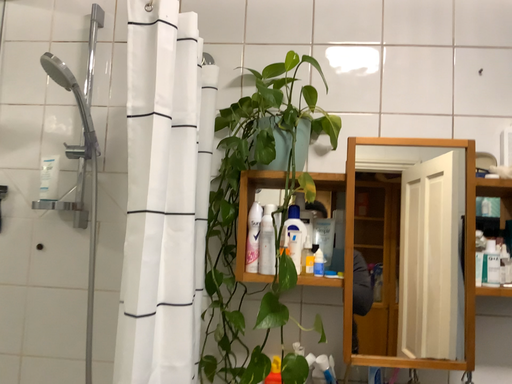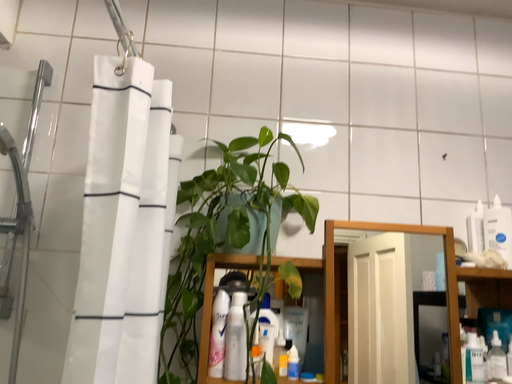
Question: Which way did the camera rotate in the video?

Choices:
 (A) rotated downward
 (B) rotated upward

Answer: (B)